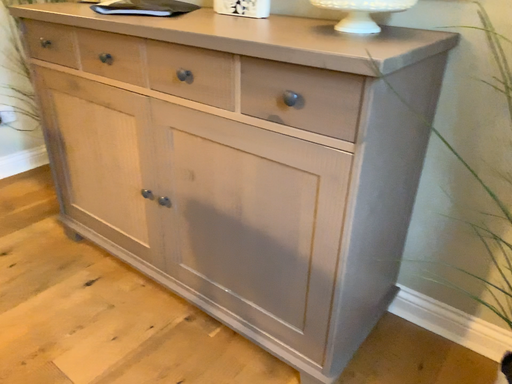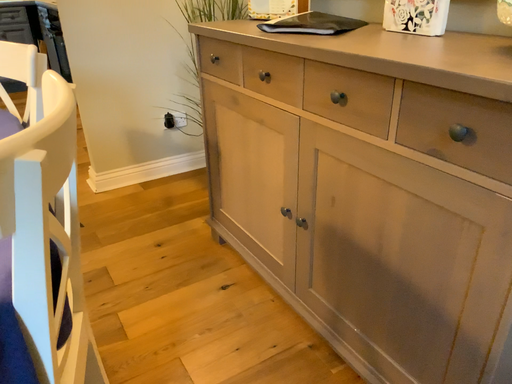
Question: Which way did the camera rotate in the video?

Choices:
 (A) rotated right
 (B) rotated left

Answer: (B)